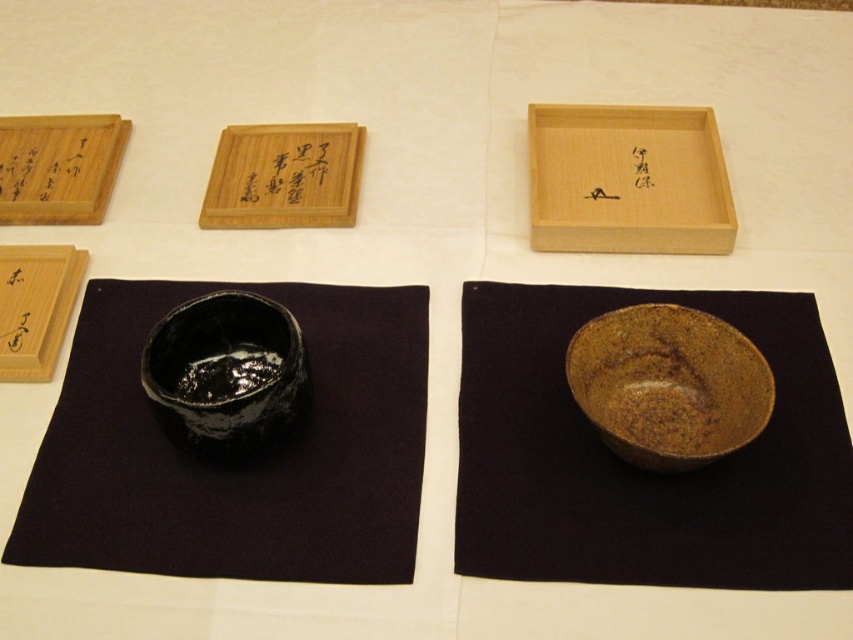
You are a tea ceremony instructor preparing a demonstration. You need to place a new item between the natural wood tray at upper center and the black glossy calligraphy at upper center. Is there enough space for it?

The natural wood tray at upper center is located below the black glossy calligraphy at upper center, so there is no vertical space between them to place a new item.

You are a photographer setting up a shot of the tea ceremony items. You want to position your camera so that the glossy black bowl at lower left is centered in the frame. What coordinate point should you aim for?

The glossy black bowl at lower left is located at coordinate point (225, 372), so you should aim for that point to center it in the frame.

You are a tea ceremony instructor arranging items on a table. You have two trays, the natural wood tray at upper center and the wooden tray at upper center. Which one is positioned to the right of the other?

The natural wood tray at upper center is positioned to the right of the wooden tray at upper center.